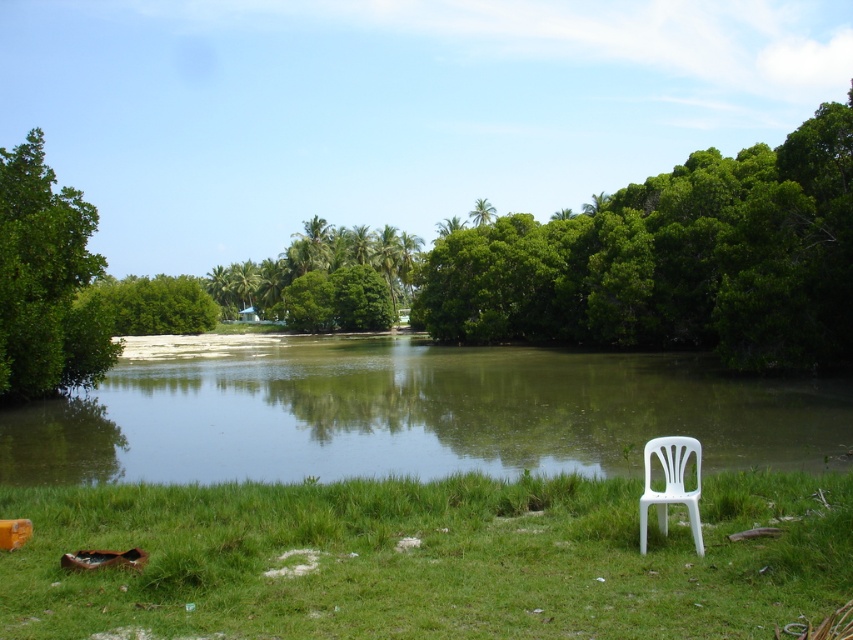
Based on the photo, you are planning to set up a small picnic area near the green grassy lake at center and the green leafy tree at upper center. Which object would you choose to place your picnic blanket closer to, considering their sizes?

→ You should place your picnic blanket closer to the green grassy lake at center because it has a smaller size compared to the green leafy tree at upper center, making it a more suitable spot for a picnic blanket.

You are standing on the green grassy lake at center and want to see the top of the green leafy tree at upper center. Can you see the top of the tree from your current position?

The green grassy lake at center has a lesser height compared to green leafy tree at upper center, so yes, you can see the top of the green leafy tree at upper center from the green grassy lake at center because the tree is taller than the lake.